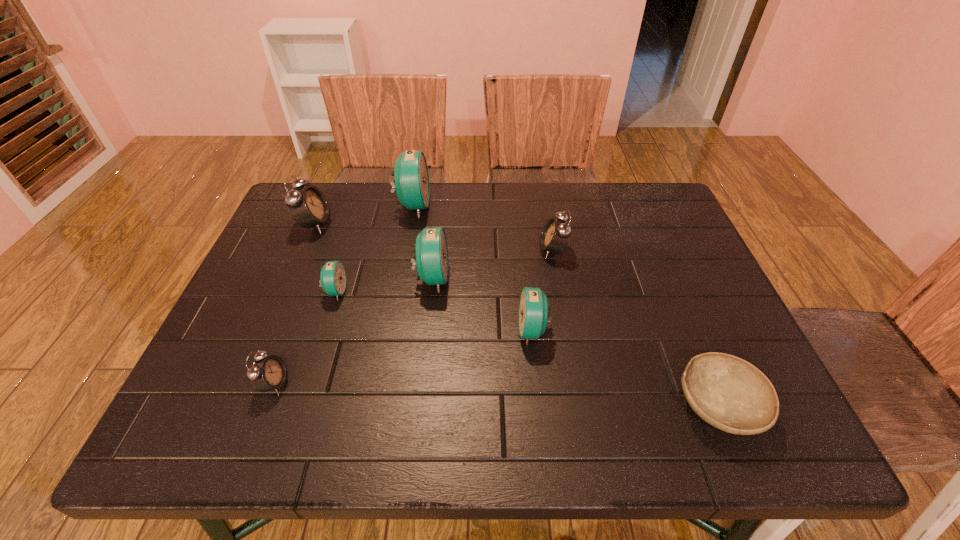
Identify the location of free region at the far edge of the desktop. (550, 193).

I want to click on free space at the near edge of the desktop, so click(x=357, y=412).

Where is `vacant position at the left edge of the desktop`? This screenshot has width=960, height=540. vacant position at the left edge of the desktop is located at coordinates (220, 369).

At what (x,y) coordinates should I click in order to perform the action: click on blank space at the far right corner of the desktop. Please return your answer as a coordinate pair (x, y). This screenshot has width=960, height=540. Looking at the image, I should click on (660, 187).

The height and width of the screenshot is (540, 960). I want to click on free space at the near right corner of the desktop, so click(x=779, y=433).

Locate an element on the screen. Image resolution: width=960 pixels, height=540 pixels. vacant area between the second biggest blue alarm clock and the second smallest blue alarm clock is located at coordinates (483, 304).

The height and width of the screenshot is (540, 960). I want to click on free spot between the biggest white alarm clock and the smallest white alarm clock, so click(x=295, y=304).

Identify the location of free spot between the sixth object from right to left and the rightmost object. click(x=527, y=348).

At what (x,y) coordinates should I click in order to perform the action: click on free spot between the third smallest blue alarm clock and the biggest white alarm clock. Please return your answer as a coordinate pair (x, y). This screenshot has height=540, width=960. Looking at the image, I should click on (373, 251).

Identify the location of free space between the rightmost alarm clock and the rightmost object. (636, 328).